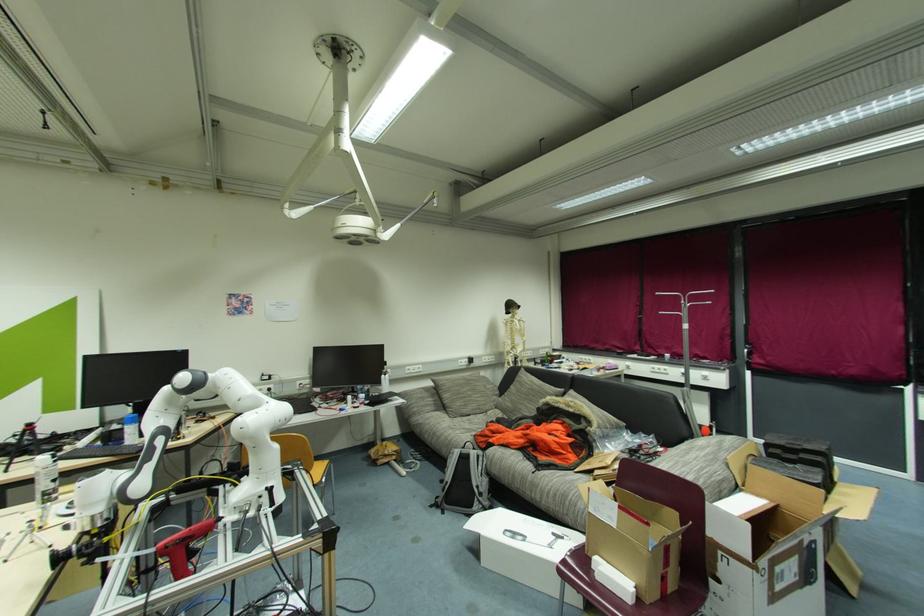
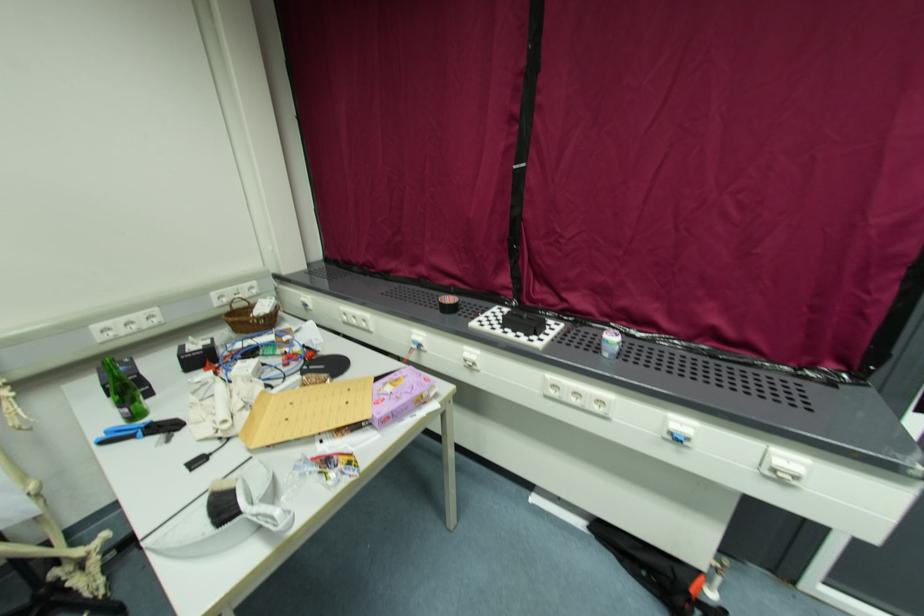
Locate, in the second image, the point that corresponds to point 551,369 in the first image.

(107, 443)